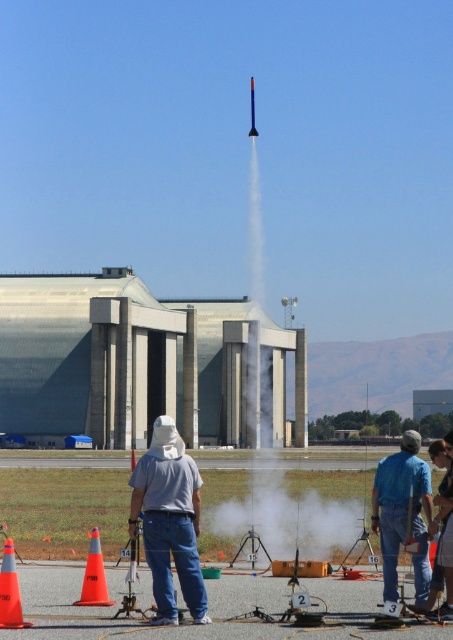
Does concrete building at center have a lesser width compared to orange plastic traffic cone at center?

Incorrect, concrete building at center's width is not less than orange plastic traffic cone at center's.

Image resolution: width=453 pixels, height=640 pixels. What are the coordinates of `concrete building at center` in the screenshot? It's located at (141, 364).

Between point (230, 426) and point (91, 531), which one is positioned behind?

The point (230, 426) is behind.

Image resolution: width=453 pixels, height=640 pixels. What are the coordinates of `concrete building at center` in the screenshot? It's located at (141, 364).

Measure the distance from gray asphalt tarmac at center to gray cotton shirt at center.

1.30 meters

In the scene shown: Can you confirm if gray asphalt tarmac at center is smaller than gray cotton shirt at center?

No.

Who is more distant from viewer, [244,577] or [183,528]?

The point [244,577] is more distant.

Where is `gray asphalt tarmac at center`? The width and height of the screenshot is (453, 640). gray asphalt tarmac at center is located at coordinates (208, 609).

Image resolution: width=453 pixels, height=640 pixels. Identify the location of orange plastic traffic cone at center. (94, 577).

At what (x,y) coordinates should I click in order to perform the action: click on orange plastic traffic cone at center. Please return your answer as a coordinate pair (x, y). The image size is (453, 640). Looking at the image, I should click on (94, 577).